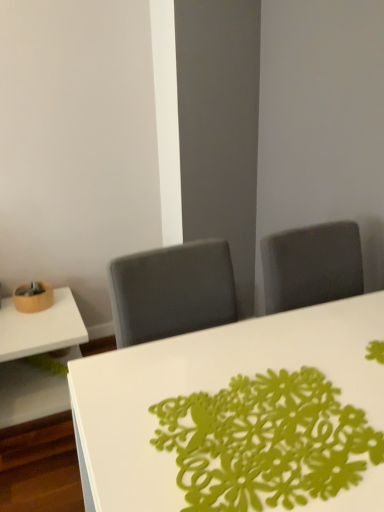
Describe the element at coordinates (239, 416) in the screenshot. This screenshot has width=384, height=512. I see `white glossy table at center, positioned as the 2th table in left-to-right order` at that location.

In order to click on green paper doily at center in this screenshot , I will do `click(266, 442)`.

Locate an element on the screen. Image resolution: width=384 pixels, height=512 pixels. white glossy table at center, the first table when ordered from front to back is located at coordinates (239, 416).

In the image, is white glossy table at center, the second table when ordered from back to front, positioned in front of or behind green paper doily at center?

Clearly, white glossy table at center, the second table when ordered from back to front, is in front of green paper doily at center.

Does white glossy table at center, the first table when ordered from front to back, have a lesser width compared to green paper doily at center?

No, white glossy table at center, the first table when ordered from front to back, is not thinner than green paper doily at center.

Considering the positions of objects green paper doily at center and white glossy table at center, acting as the 1th table starting from the right, in the image provided, who is more to the right, green paper doily at center or white glossy table at center, acting as the 1th table starting from the right,?

white glossy table at center, acting as the 1th table starting from the right, is more to the right.

Where is `the 1st table located beneath the green paper doily at center (from a real-world perspective)`? The width and height of the screenshot is (384, 512). the 1st table located beneath the green paper doily at center (from a real-world perspective) is located at coordinates (239, 416).

From a real-world perspective, which is physically below, green paper doily at center or white glossy table at center, the second table when ordered from back to front?

From a 3D spatial view, white glossy table at center, the second table when ordered from back to front, is below.

Looking at their sizes, would you say green paper doily at center is wider or thinner than white glossy table at center, acting as the 1th table starting from the right?

green paper doily at center is thinner than white glossy table at center, acting as the 1th table starting from the right.

Between point (5, 347) and point (331, 406), which one is positioned behind?

The point (5, 347) is behind.

Looking at the image, does white glossy table at lower left, which ranks as the first table in back-to-front order, seem bigger or smaller compared to green paper doily at center?

white glossy table at lower left, which ranks as the first table in back-to-front order, is bigger than green paper doily at center.

Could you measure the distance between white glossy table at lower left, the first table positioned from the left, and green paper doily at center?

A distance of 4.37 feet exists between white glossy table at lower left, the first table positioned from the left, and green paper doily at center.

In terms of height, does white glossy table at lower left, arranged as the second table when viewed from the right, look taller or shorter compared to green paper doily at center?

Considering their sizes, white glossy table at lower left, arranged as the second table when viewed from the right, has more height than green paper doily at center.

In terms of height, does green paper doily at center look taller or shorter compared to white glossy table at lower left, the first table positioned from the left?

In the image, green paper doily at center appears to be shorter than white glossy table at lower left, the first table positioned from the left.

Considering the relative sizes of green paper doily at center and white glossy table at lower left, the first table positioned from the left, in the image provided, is green paper doily at center smaller than white glossy table at lower left, the first table positioned from the left,?

Yes, green paper doily at center is smaller than white glossy table at lower left, the first table positioned from the left.

Is green paper doily at center wider than white glossy table at lower left, which ranks as the first table in back-to-front order?

→ No, green paper doily at center is not wider than white glossy table at lower left, which ranks as the first table in back-to-front order.

From the image's perspective, would you say green paper doily at center is positioned over white glossy table at lower left, the second table viewed from the front?

Yes, from the image's perspective, green paper doily at center is above white glossy table at lower left, the second table viewed from the front.

Is white glossy table at center, the first table when ordered from front to back, surrounded by white glossy table at lower left, the second table viewed from the front?

No.

Is white glossy table at lower left, arranged as the second table when viewed from the right, to the right of white glossy table at center, positioned as the 2th table in left-to-right order, from the viewer's perspective?

No.

Considering the relative sizes of white glossy table at lower left, which ranks as the first table in back-to-front order, and white glossy table at center, the first table when ordered from front to back, in the image provided, is white glossy table at lower left, which ranks as the first table in back-to-front order, bigger than white glossy table at center, the first table when ordered from front to back,?

No.

From their relative heights in the image, would you say white glossy table at lower left, arranged as the second table when viewed from the right, is taller or shorter than white glossy table at center, positioned as the 2th table in left-to-right order?

Considering their sizes, white glossy table at lower left, arranged as the second table when viewed from the right, has less height than white glossy table at center, positioned as the 2th table in left-to-right order.

Which of these two, white glossy table at center, the first table when ordered from front to back, or white glossy table at lower left, which ranks as the first table in back-to-front order, stands taller?

Standing taller between the two is white glossy table at center, the first table when ordered from front to back.

Does white glossy table at center, acting as the 1th table starting from the right, touch white glossy table at lower left, arranged as the second table when viewed from the right?

No, white glossy table at center, acting as the 1th table starting from the right, is not with white glossy table at lower left, arranged as the second table when viewed from the right.

Does white glossy table at center, acting as the 1th table starting from the right, lie behind white glossy table at lower left, the first table positioned from the left?

No, white glossy table at center, acting as the 1th table starting from the right, is closer to the viewer.

The height and width of the screenshot is (512, 384). I want to click on floral arrangement behind the white glossy table at center, the first table when ordered from front to back, so click(266, 442).

I want to click on floral arrangement on the left of white glossy table at center, the second table when ordered from back to front, so click(x=266, y=442).

Looking at the image, which one is located further to white glossy table at center, the first table when ordered from front to back, white glossy table at lower left, the first table positioned from the left, or green paper doily at center?

The object further to white glossy table at center, the first table when ordered from front to back, is white glossy table at lower left, the first table positioned from the left.

Looking at the image, which one is located further to green paper doily at center, white glossy table at lower left, the second table viewed from the front, or white glossy table at center, the second table when ordered from back to front?

Based on the image, white glossy table at lower left, the second table viewed from the front, appears to be further to green paper doily at center.

Looking at the image, which one is located closer to white glossy table at center, acting as the 1th table starting from the right, green paper doily at center or white glossy table at lower left, which ranks as the first table in back-to-front order?

green paper doily at center is closer to white glossy table at center, acting as the 1th table starting from the right.

When comparing their distances from white glossy table at lower left, arranged as the second table when viewed from the right, does white glossy table at center, the first table when ordered from front to back, or green paper doily at center seem further?

Result: green paper doily at center lies further to white glossy table at lower left, arranged as the second table when viewed from the right, than the other object.

Based on their spatial positions, is white glossy table at center, positioned as the 2th table in left-to-right order, or white glossy table at lower left, the first table positioned from the left, closer to green paper doily at center?

The object closer to green paper doily at center is white glossy table at center, positioned as the 2th table in left-to-right order.

Estimate the real-world distances between objects in this image. Which object is further from white glossy table at lower left, the first table positioned from the left, green paper doily at center or white glossy table at center, the second table when ordered from back to front?

The object further to white glossy table at lower left, the first table positioned from the left, is green paper doily at center.

This screenshot has height=512, width=384. I want to click on floral arrangement between white glossy table at center, the second table when ordered from back to front, and white glossy table at lower left, the first table positioned from the left, in the front-back direction, so click(x=266, y=442).